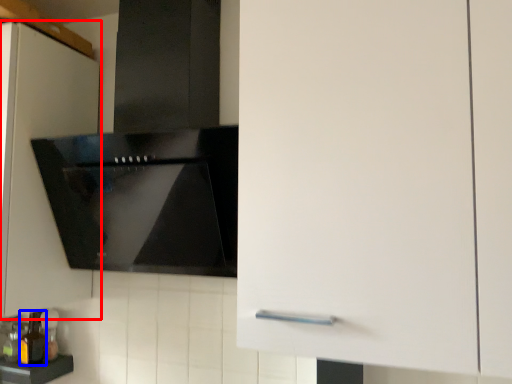
Question: Which object is closer to the camera taking this photo, cabinetry (highlighted by a red box) or bottle (highlighted by a blue box)?

Choices:
 (A) cabinetry
 (B) bottle

Answer: (A)